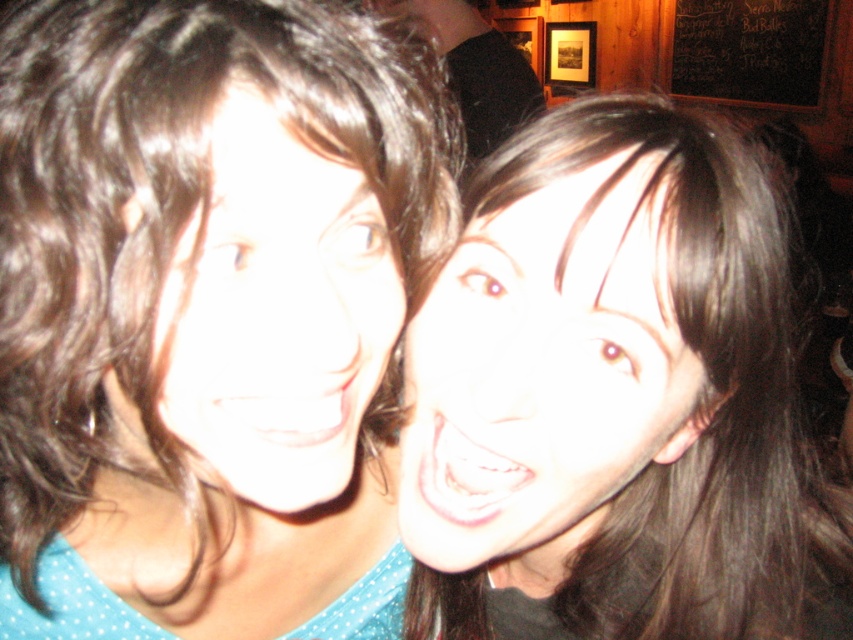
You are a photographer trying to frame a portrait of the two people in the scene. You want to ensure that both the smooth brown hair at center and the smooth skin face at center are clearly visible. Given their sizes, which object should you focus on to ensure proper framing?

The smooth brown hair at center is wider than the smooth skin face at center, so focusing on the smooth brown hair at center will ensure both are properly framed.

You are a photographer adjusting the lighting for a portrait. The subject has smooth brown hair at center. Where should you position the light to ensure it falls directly on their hair?

The smooth brown hair at center is located at point (x=207, y=314), so you should position the light directly at that coordinate to illuminate the hair effectively.

You are a photographer adjusting the focus on your camera. The camera can only focus on objects within 12 inches from it. You see the smooth brown hair at center in your viewfinder. Will the camera focus on it?

The smooth brown hair at center is 12.10 inches away from camera, which is just beyond the 12 inch focus range. The camera will not focus on it.